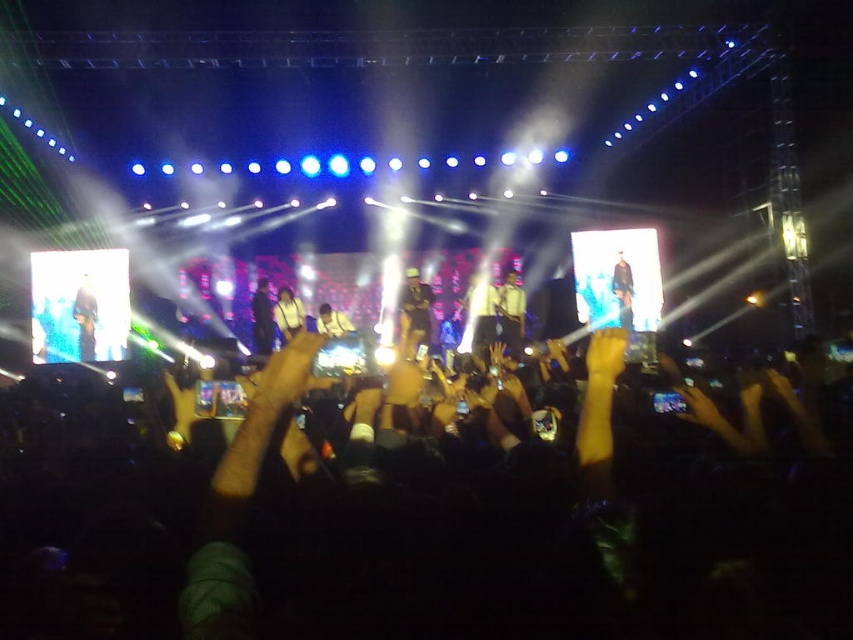
Question: Is yellow shirt at center wider than white glossy shirt at center?

Choices:
 (A) yes
 (B) no

Answer: (B)

Question: Is dark blue jeans at center closer to camera compared to white glossy shirt at center?

Choices:
 (A) yes
 (B) no

Answer: (B)

Question: Considering the real-world distances, which object is farthest from the white shirt at center?

Choices:
 (A) dark brown leather jacket at center
 (B) dark blue jeans at center
 (C) yellow shirt at center
 (D) white glossy shirt at center

Answer: (D)

Question: Which object is the farthest from the white glossy shirt at center?

Choices:
 (A) yellow shirt at center
 (B) dark blue leather jacket at center
 (C) dark blue jeans at center

Answer: (C)

Question: Can you confirm if white shirt at center is positioned below white glossy shirt at center?

Choices:
 (A) no
 (B) yes

Answer: (B)

Question: Which object is positioned closest to the dark brown leather jacket at center?

Choices:
 (A) white fabric shirt at center
 (B) dark blue jeans at center
 (C) white glossy shirt at center

Answer: (A)